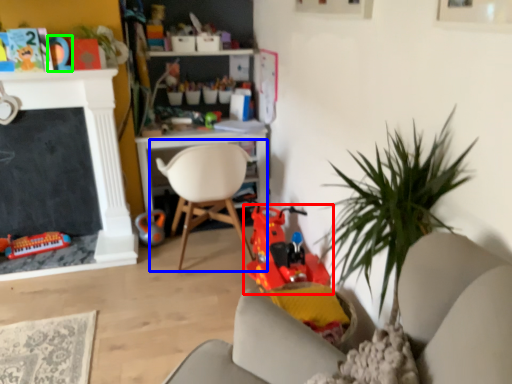
Question: Estimate the real-world distances between objects in this image. Which object is farther from toy (highlighted by a red box), chair (highlighted by a blue box) or toy (highlighted by a green box)?

Choices:
 (A) chair
 (B) toy

Answer: (B)